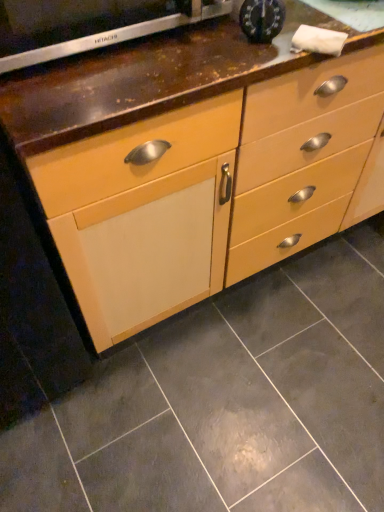
Where is `free location to the right of metallic clock at upper center, acting as the second appliance starting from the left`? The image size is (384, 512). free location to the right of metallic clock at upper center, acting as the second appliance starting from the left is located at coordinates [x=331, y=22].